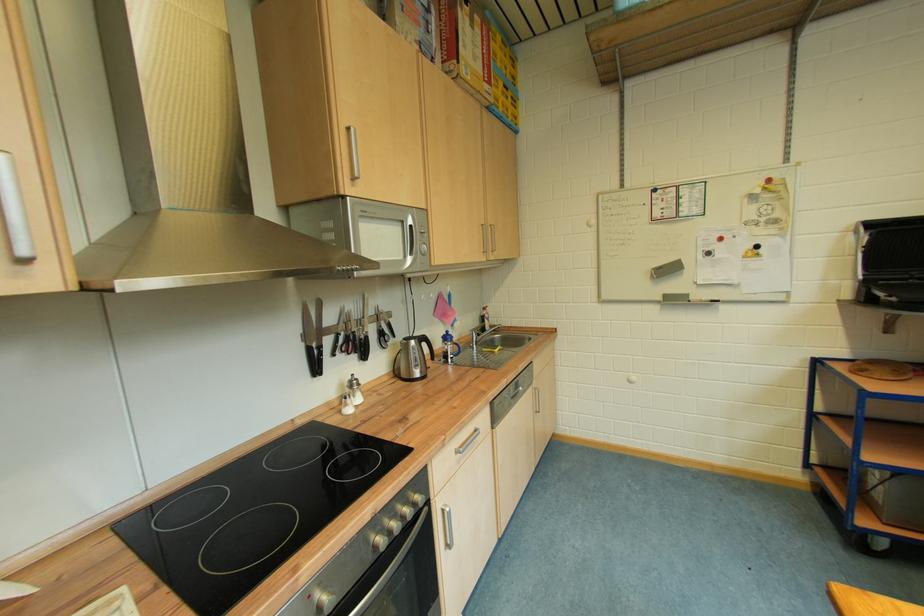
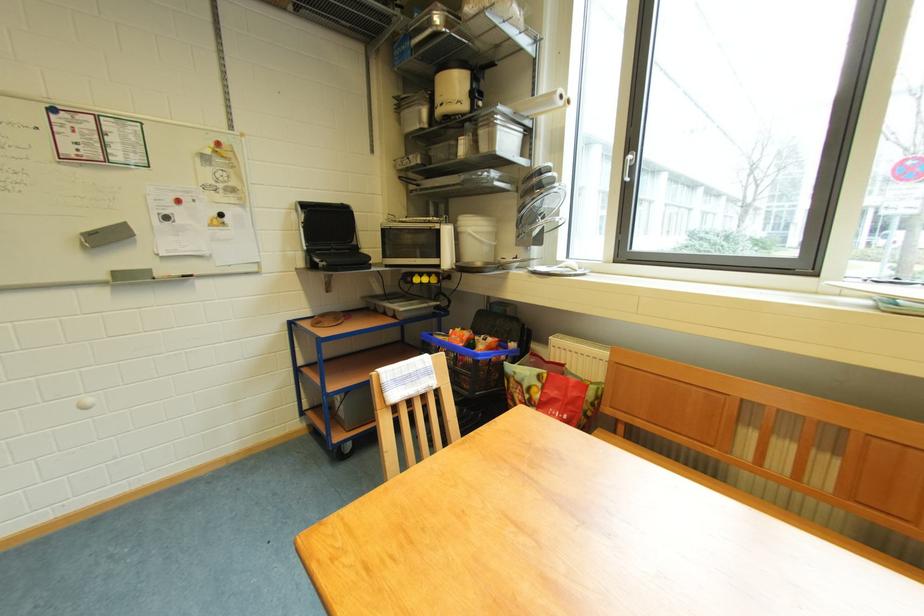
Where in the second image is the point corresponding to (864,235) from the first image?

(305, 214)